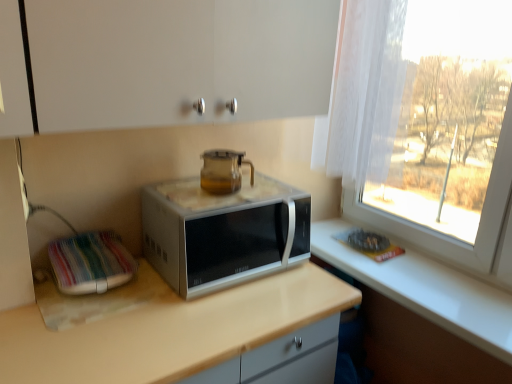
Question: Can you confirm if white fabric at left is shorter than beige laminate countertop at center?

Choices:
 (A) yes
 (B) no

Answer: (A)

Question: Considering the relative sizes of white fabric at left and beige laminate countertop at center in the image provided, is white fabric at left taller than beige laminate countertop at center?

Choices:
 (A) yes
 (B) no

Answer: (B)

Question: Is white fabric at left far from beige laminate countertop at center?

Choices:
 (A) no
 (B) yes

Answer: (A)

Question: From the image's perspective, does white fabric at left appear higher than beige laminate countertop at center?

Choices:
 (A) no
 (B) yes

Answer: (B)

Question: Can you confirm if white fabric at left is smaller than beige laminate countertop at center?

Choices:
 (A) yes
 (B) no

Answer: (A)

Question: Is point (306, 203) positioned closer to the camera than point (217, 190)?

Choices:
 (A) farther
 (B) closer

Answer: (A)

Question: Is satin silver microwave at center inside the boundaries of transparent glass teapot at center, or outside?

Choices:
 (A) inside
 (B) outside

Answer: (B)

Question: Is satin silver microwave at center bigger or smaller than transparent glass teapot at center?

Choices:
 (A) big
 (B) small

Answer: (A)

Question: In terms of width, does satin silver microwave at center look wider or thinner when compared to transparent glass teapot at center?

Choices:
 (A) thin
 (B) wide

Answer: (B)

Question: Is point (224, 162) positioned closer to the camera than point (78, 327)?

Choices:
 (A) farther
 (B) closer

Answer: (A)

Question: Is transparent glass teapot at center spatially inside beige laminate countertop at center, or outside of it?

Choices:
 (A) outside
 (B) inside

Answer: (A)

Question: Based on their sizes in the image, would you say transparent glass teapot at center is bigger or smaller than beige laminate countertop at center?

Choices:
 (A) big
 (B) small

Answer: (B)

Question: Is transparent glass teapot at center wider or thinner than beige laminate countertop at center?

Choices:
 (A) wide
 (B) thin

Answer: (B)

Question: In terms of width, does beige laminate countertop at center look wider or thinner when compared to satin silver microwave at center?

Choices:
 (A) thin
 (B) wide

Answer: (B)

Question: Choose the correct answer: Is beige laminate countertop at center inside satin silver microwave at center or outside it?

Choices:
 (A) inside
 (B) outside

Answer: (B)